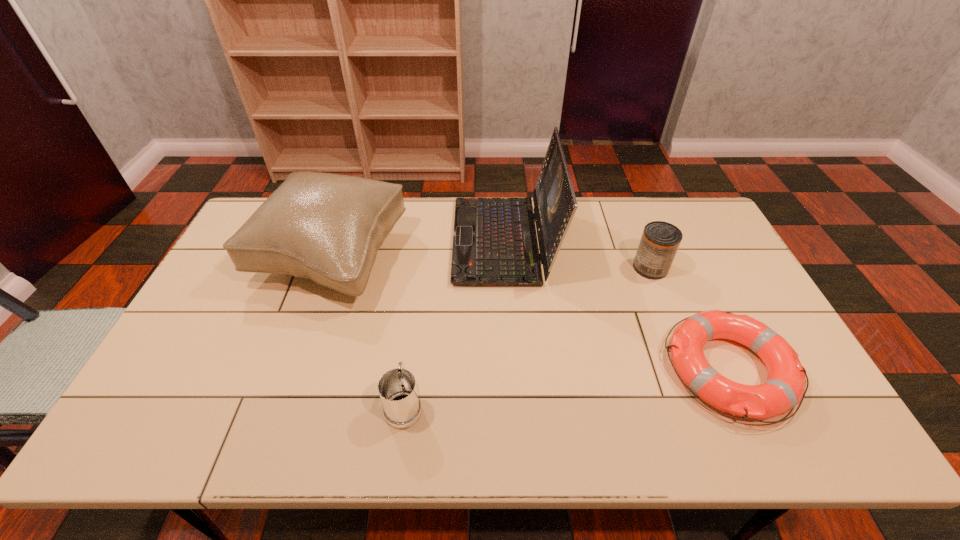
Identify the location of laptop computer. The image size is (960, 540). (495, 243).

This screenshot has height=540, width=960. In order to click on cushion in this screenshot , I will do `click(326, 227)`.

You are a GUI agent. You are given a task and a screenshot of the screen. Output one action in this format:
    pyautogui.click(x=<x>, y=<y>)
    Task: Click on the leftmost object
    
    Given the screenshot: What is the action you would take?
    pyautogui.click(x=326, y=227)

Find the location of a particular element. This screenshot has width=960, height=540. can is located at coordinates (660, 241).

The width and height of the screenshot is (960, 540). Identify the location of mug. (397, 388).

At what (x,y) coordinates should I click in order to perform the action: click on the second object from left to right. Please return your answer as a coordinate pair (x, y). Looking at the image, I should click on (397, 388).

The width and height of the screenshot is (960, 540). In order to click on life buoy in this screenshot , I will do `click(784, 388)`.

At what (x,y) coordinates should I click in order to perform the action: click on vacant space located 0.340m on the screen of the laptop computer. Please return your answer as a coordinate pair (x, y). The width and height of the screenshot is (960, 540). Looking at the image, I should click on (352, 241).

Find the location of a particular element. vacant region located 0.210m on the screen of the laptop computer is located at coordinates (391, 241).

What are the coordinates of `free space located on the screen of the laptop computer` in the screenshot? It's located at (340, 241).